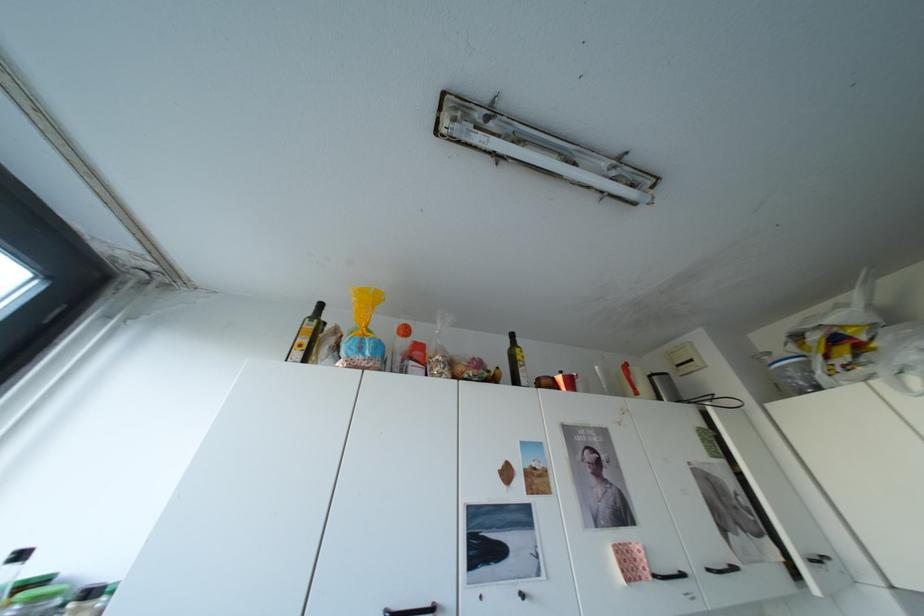
The location [841,336] corresponds to which object?

It corresponds to the netted food bag in the image.